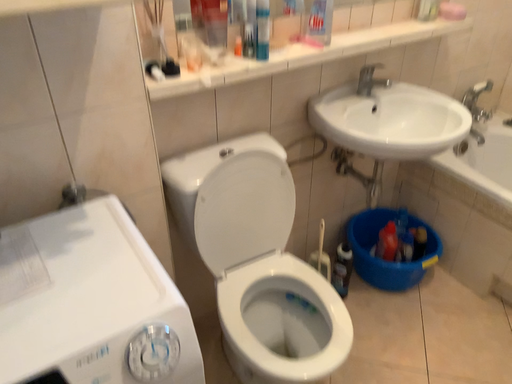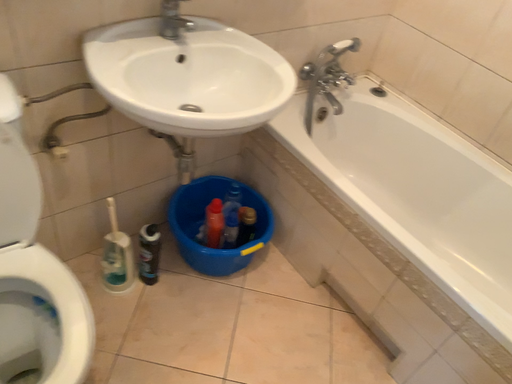
Question: How did the camera likely rotate when shooting the video?

Choices:
 (A) rotated left
 (B) rotated right

Answer: (B)